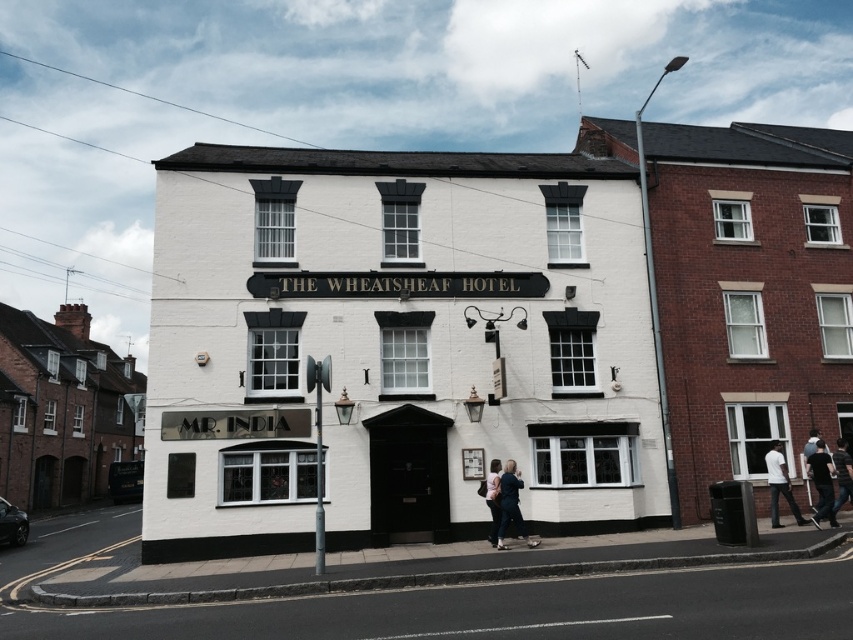
Consider the image. You are a hotel guest who wants to choose an outfit for a casual dinner. You have a dark blue dress at lower center and dark blue jeans at lower right in your wardrobe. Which option takes up less storage space in your suitcase?

The dark blue dress at lower center occupies less space than dark blue jeans at lower right, so it would take up less storage space in your suitcase.

You are standing at the entrance of the hotel and need to place a 20 feet long banner between the black cotton shirt at lower right and the light brown leather jacket at lower center. Can the banner fit between them without overlapping?

The distance between the black cotton shirt at lower right and the light brown leather jacket at lower center is 22.26 feet. Since the banner is 20 feet long, it can fit between them without overlapping.

You are a guest at the hotel and need to choose between the black cotton shirt at lower right and the light brown leather jacket at lower center to wear for a casual evening dinner. Based on their sizes, which one might be more suitable for a taller person?

The light brown leather jacket at lower center is taller than the black cotton shirt at lower right, so it would be more suitable for a taller person.